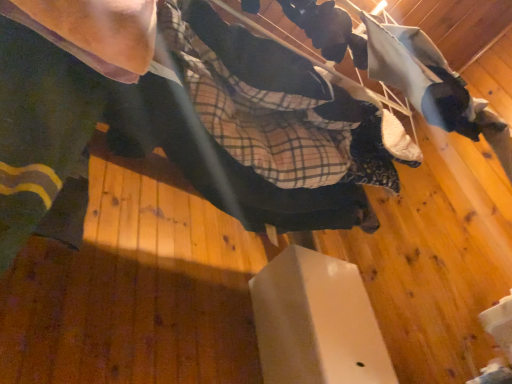
Question: From the image's perspective, is white matte box at center positioned above or below fluffy white blanket at upper right?

Choices:
 (A) above
 (B) below

Answer: (B)

Question: In terms of width, does white matte box at center look wider or thinner when compared to fluffy white blanket at upper right?

Choices:
 (A) thin
 (B) wide

Answer: (B)

Question: Estimate the real-world distances between objects in this image. Which object is farther from the fluffy white blanket at upper right?

Choices:
 (A) white matte box at center
 (B) matte black arm at upper left
 (C) matte black skateboard at center

Answer: (A)

Question: Which of these objects is positioned closest to the fluffy white blanket at upper right?

Choices:
 (A) matte black arm at upper left
 (B) white matte box at center
 (C) matte black skateboard at center

Answer: (C)